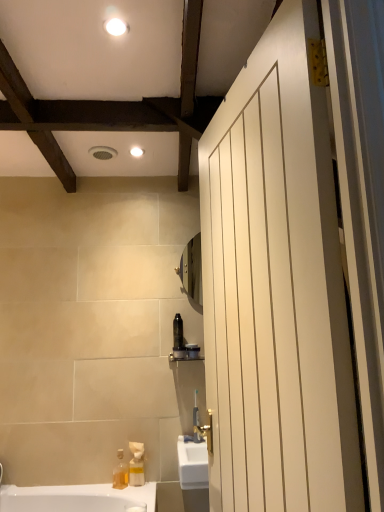
At what (x,y) coordinates should I click in order to perform the action: click on free space in front of white glossy light fixture at upper center, the second light fixture positioned from the back. Please return your answer as a coordinate pair (x, y). This screenshot has width=384, height=512. Looking at the image, I should click on (117, 6).